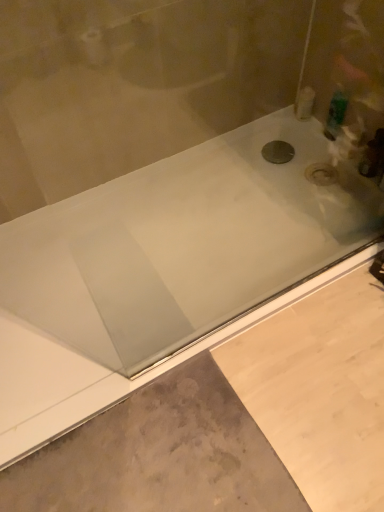
Identify the location of free space between green plastic bottle at upper right, which is counted as the 2th toiletry, starting from the left, and black metallic drain at center. (303, 147).